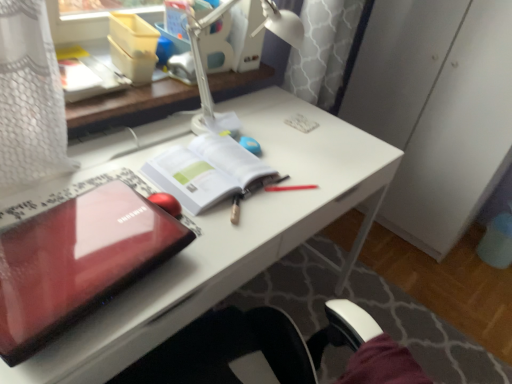
The height and width of the screenshot is (384, 512). What are the coordinates of `vacant space behind white plastic lamp at upper center` in the screenshot? It's located at (272, 105).